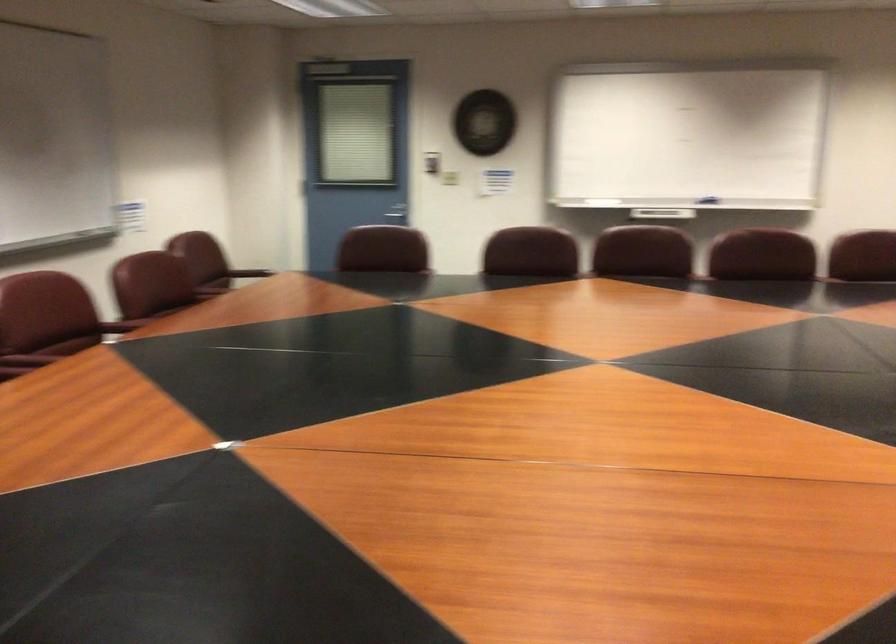
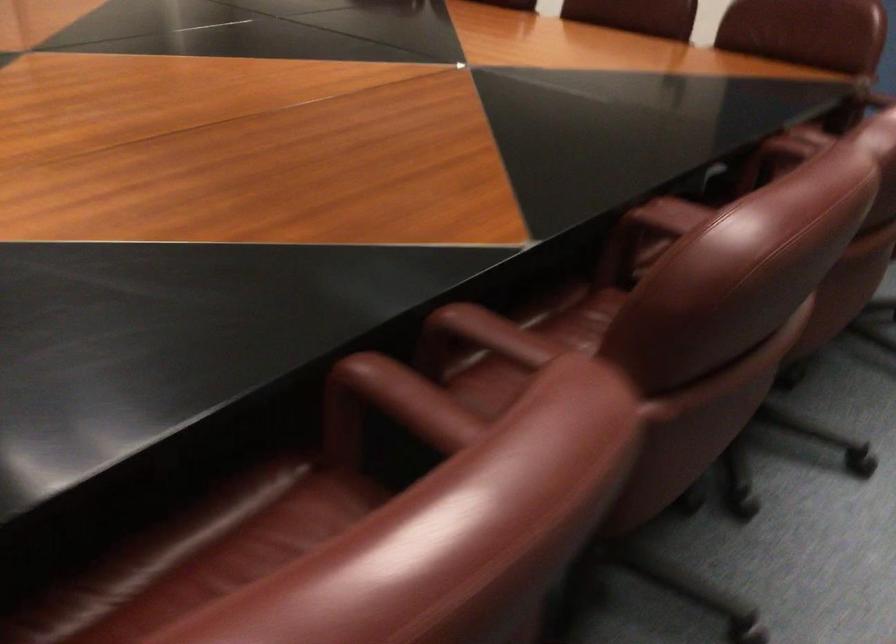
Based on the continuous images, in which direction is the camera rotating?

The camera rotated toward right-down.